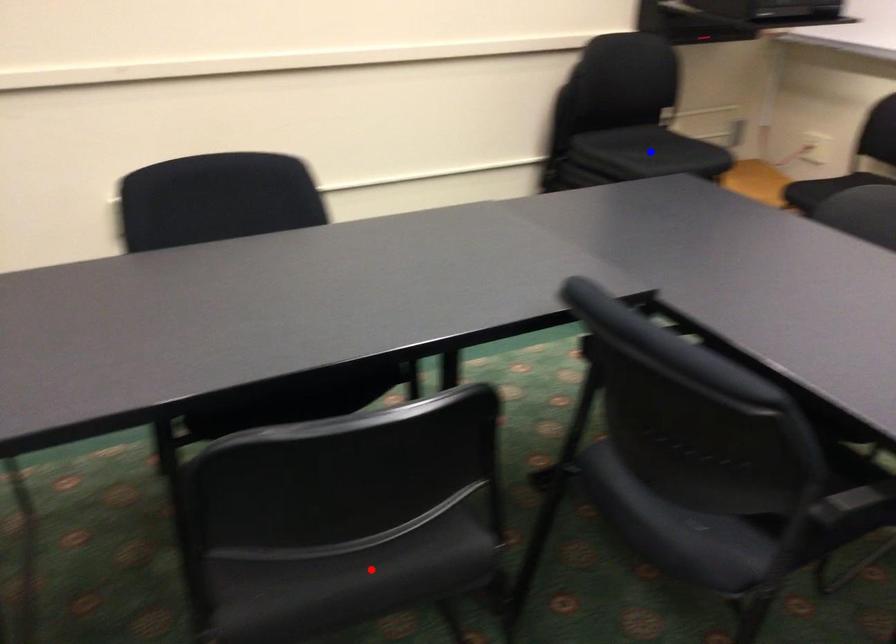
Question: Two points are marked on the image. Which point is closer to the camera?

Choices:
 (A) Blue point is closer.
 (B) Red point is closer.

Answer: (B)